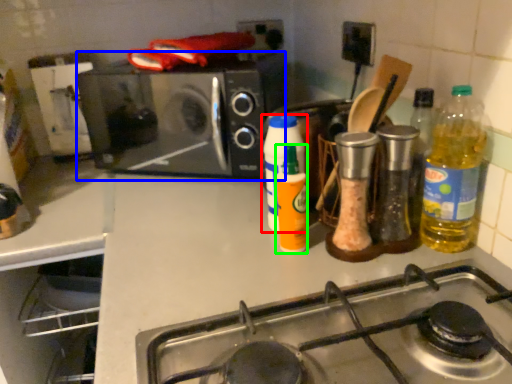
Question: Which object is the closest to the bottle (highlighted by a red box)? Choose among these: microwave oven (highlighted by a blue box) or bottle (highlighted by a green box).

Choices:
 (A) microwave oven
 (B) bottle

Answer: (B)